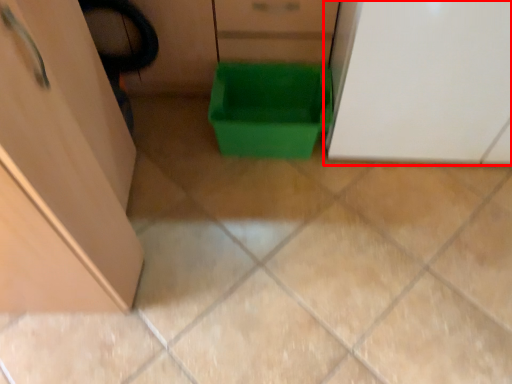
Question: From the image's perspective, considering the relative positions of cabinetry (annotated by the red box) and storage box in the image provided, where is cabinetry (annotated by the red box) located with respect to the staircase?

Choices:
 (A) above
 (B) below

Answer: (A)